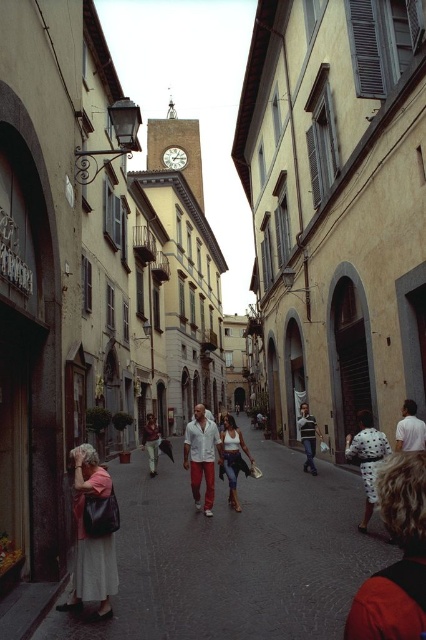
Question: Which point is farther to the camera?

Choices:
 (A) dotted fabric bag at center
 (B) white cotton shirt at center

Answer: (B)

Question: Which object appears farthest from the camera in this image?

Choices:
 (A) striped cotton shirt at center
 (B) white cotton shirt at right
 (C) dotted fabric bag at center

Answer: (A)

Question: Where is fluffy fur coat at lower right located in relation to matte white pants at center in the image?

Choices:
 (A) above
 (B) below

Answer: (A)

Question: Is white cotton dress at lower left bigger than dotted fabric bag at center?

Choices:
 (A) yes
 (B) no

Answer: (A)

Question: Does matte pink dress at lower left come in front of white cotton shirt at center?

Choices:
 (A) yes
 (B) no

Answer: (A)

Question: Which object appears farthest from the camera in this image?

Choices:
 (A) fluffy fur coat at lower right
 (B) striped cotton shirt at center
 (C) matte pink dress at lower left

Answer: (B)